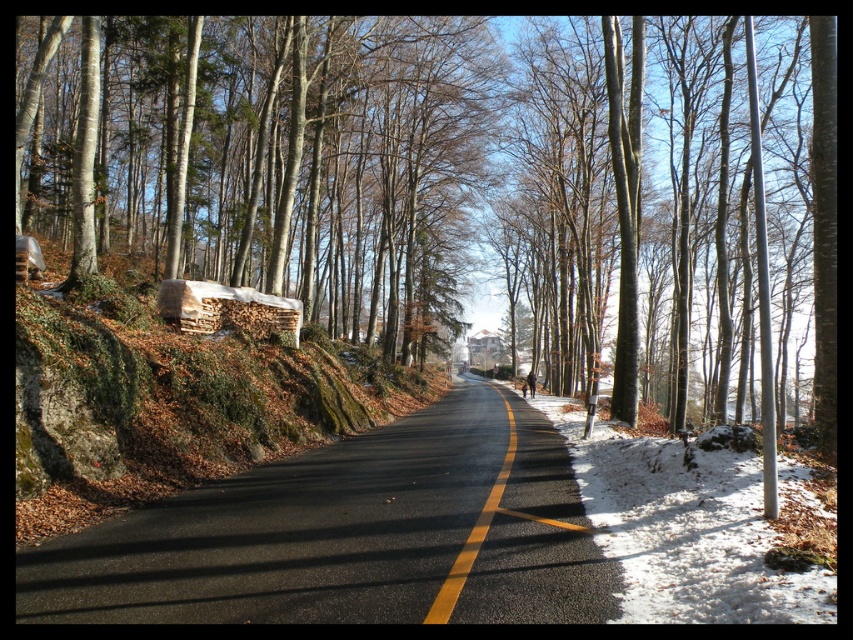
You are driving a car that is 4 meters long and want to park on the road between the brown woodpile at center and the brown woodpile at left. Is there enough space between them to park your car?

The distance between the brown woodpile at center and the brown woodpile at left is 21.19 meters, which is more than enough to park a 4 meter long car between them.

You are driving a car on the yellow asphalt road at center and want to park under the smooth bark tree at left. Is the tree tall enough to provide shade for your car?

The smooth bark tree at left is taller than the yellow asphalt road at center, so it should provide sufficient shade for your car.